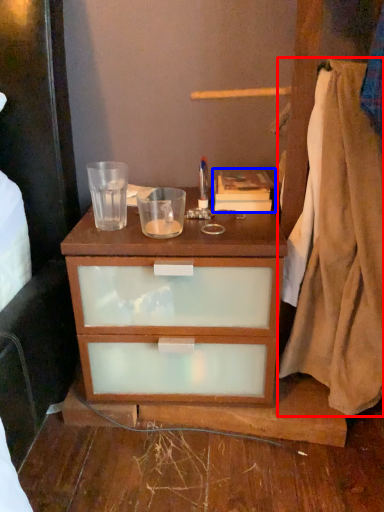
Question: Which of the following is the closest to the observer, blanket (highlighted by a red box) or book (highlighted by a blue box)?

Choices:
 (A) blanket
 (B) book

Answer: (A)